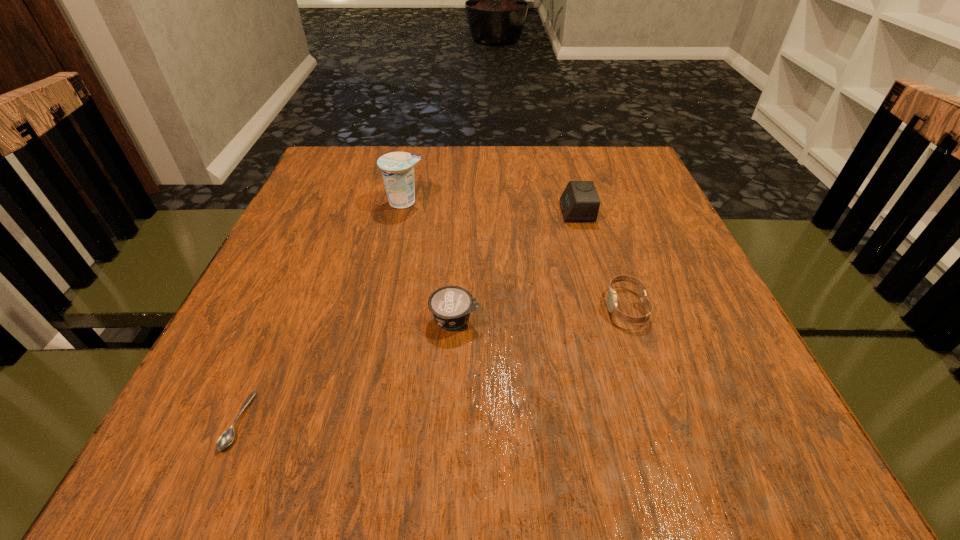
Find the location of `free space located on the front-facing side of the alarm clock`. free space located on the front-facing side of the alarm clock is located at coordinates (483, 212).

At what (x,y) coordinates should I click in order to perform the action: click on free space located on the front-facing side of the alarm clock. Please return your answer as a coordinate pair (x, y). Looking at the image, I should click on (430, 212).

In order to click on free space located on the face of the watch in this screenshot , I will do `click(562, 307)`.

The image size is (960, 540). In order to click on vacant area situated 0.200m on the face of the watch in this screenshot , I will do `click(495, 307)`.

At what (x,y) coordinates should I click in order to perform the action: click on vacant space located 0.290m on the face of the watch. Please return your answer as a coordinate pair (x, y). The width and height of the screenshot is (960, 540). Looking at the image, I should click on (445, 307).

The image size is (960, 540). I want to click on vacant region located on the front of the nearer yogurt, so click(449, 424).

Where is `free space located on the back of the shortest object`? The height and width of the screenshot is (540, 960). free space located on the back of the shortest object is located at coordinates (307, 261).

I want to click on object at the far edge, so click(x=397, y=168).

Identify the location of object positioned at the near edge. The height and width of the screenshot is (540, 960). (227, 437).

This screenshot has height=540, width=960. In order to click on object situated at the left edge in this screenshot , I will do pyautogui.click(x=227, y=437).